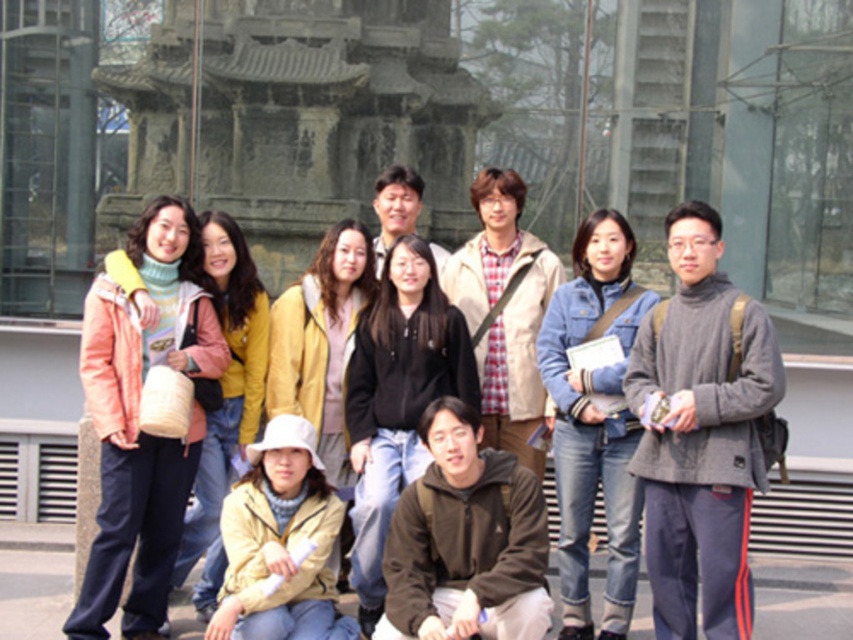
You are a photographer trying to capture a photo of the group. You notice the gray wool sweater at center and the pink fleece jacket at left. Which person should you focus on first if you want to start from the left side of the group?

The pink fleece jacket at left is on the left side, so you should focus on the pink fleece jacket at left first.

You are a photographer trying to capture a closeup of the gray wool sweater at center and the brown fleece jacket at lower center. Given their sizes, which one would require you to step back to frame properly?

The gray wool sweater at center is wider than the brown fleece jacket at lower center. To frame the gray wool sweater at center properly, you would need to step back to capture its full width, while the brown fleece jacket at lower center can be framed from a closer distance.